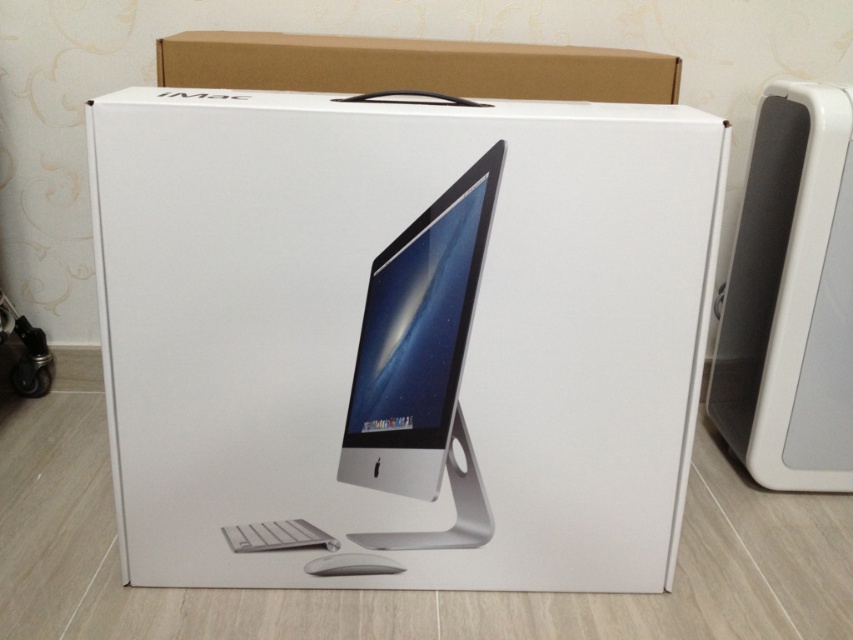
Is point (630, 592) positioned before point (621, 93)?

Yes.

Is white matte cardboard box at center shorter than brown cardboard at upper center?

No.

Between point (247, 189) and point (585, 83), which one is positioned behind?

The point (585, 83) is behind.

What are the coordinates of `white matte cardboard box at center` in the screenshot? It's located at (401, 333).

Can you confirm if white matte cardboard box at center is shorter than white matte mouse at lower center?

In fact, white matte cardboard box at center may be taller than white matte mouse at lower center.

Find the location of a particular element. The image size is (853, 640). white matte cardboard box at center is located at coordinates (401, 333).

Describe the element at coordinates (401, 333) in the screenshot. I see `white matte cardboard box at center` at that location.

Does white matte cardboard box at center appear under white glossy computer monitor at center?

Indeed, white matte cardboard box at center is positioned under white glossy computer monitor at center.

Find the location of a particular element. white matte cardboard box at center is located at coordinates (401, 333).

Image resolution: width=853 pixels, height=640 pixels. In order to click on white matte cardboard box at center in this screenshot , I will do `click(401, 333)`.